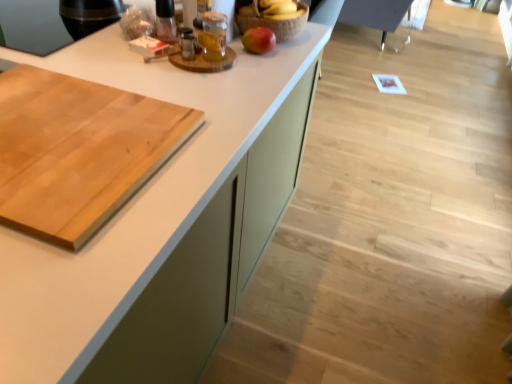
Question: Can we say translucent glass jar at upper center lies outside natural wood cutting board at left?

Choices:
 (A) no
 (B) yes

Answer: (B)

Question: Is translucent glass jar at upper center in front of natural wood cutting board at left?

Choices:
 (A) yes
 (B) no

Answer: (B)

Question: Can you confirm if translucent glass jar at upper center is positioned to the left of natural wood cutting board at left?

Choices:
 (A) yes
 (B) no

Answer: (B)

Question: From a real-world perspective, is translucent glass jar at upper center physically below natural wood cutting board at left?

Choices:
 (A) no
 (B) yes

Answer: (A)

Question: From the image's perspective, is translucent glass jar at upper center below natural wood cutting board at left?

Choices:
 (A) yes
 (B) no

Answer: (B)

Question: Is white matte countertop at center wider or thinner than natural wood cutting board at left?

Choices:
 (A) wide
 (B) thin

Answer: (A)

Question: Considering their positions, is white matte countertop at center located in front of or behind natural wood cutting board at left?

Choices:
 (A) behind
 (B) front

Answer: (B)

Question: Is point (285, 92) positioned closer to the camera than point (96, 104)?

Choices:
 (A) farther
 (B) closer

Answer: (A)

Question: Visually, is white matte countertop at center positioned to the left or to the right of natural wood cutting board at left?

Choices:
 (A) right
 (B) left

Answer: (A)

Question: Is natural wood cutting board at left bigger or smaller than translucent glass jar at upper center?

Choices:
 (A) big
 (B) small

Answer: (A)

Question: Is natural wood cutting board at left in front of or behind translucent glass jar at upper center in the image?

Choices:
 (A) front
 (B) behind

Answer: (A)

Question: Based on their positions, is natural wood cutting board at left located to the left or right of translucent glass jar at upper center?

Choices:
 (A) right
 (B) left

Answer: (B)

Question: From the image's perspective, relative to translucent glass jar at upper center, is natural wood cutting board at left above or below?

Choices:
 (A) below
 (B) above

Answer: (A)

Question: From a real-world perspective, is natural wood cutting board at left above or below red matte apple at upper center?

Choices:
 (A) below
 (B) above

Answer: (A)

Question: In terms of width, does natural wood cutting board at left look wider or thinner when compared to red matte apple at upper center?

Choices:
 (A) wide
 (B) thin

Answer: (A)